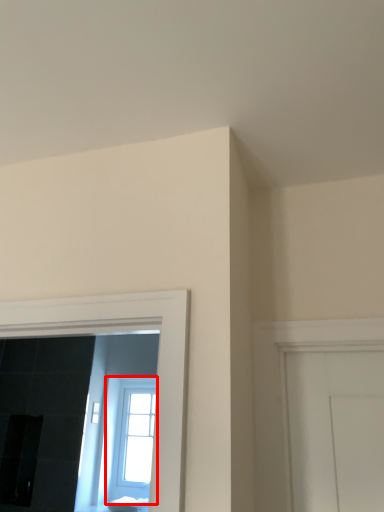
Question: Considering the relative positions of window (annotated by the red box) and furniture in the image provided, where is window (annotated by the red box) located with respect to the staircase?

Choices:
 (A) right
 (B) left

Answer: (B)